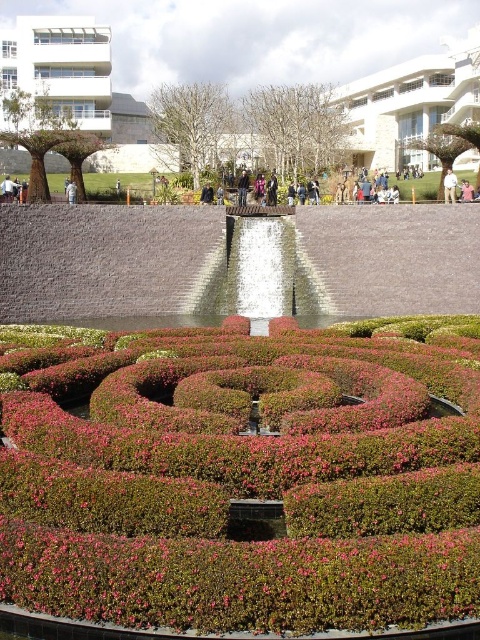
Question: Based on their relative distances, which object is farther from the light brown leather jacket at center?

Choices:
 (A) green leafy hedge at center
 (B) light brown wooden statue at center
 (C) light brown wooden bench at center
 (D) light brown leather jacket at lower left

Answer: (A)

Question: Is dark blue jeans at center above light brown wooden bench at center?

Choices:
 (A) no
 (B) yes

Answer: (B)

Question: Is light beige pants at center positioned behind light brown leather jacket at lower left?

Choices:
 (A) no
 (B) yes

Answer: (A)

Question: Among these points, which one is nearest to the camera?

Choices:
 (A) (462, 189)
 (B) (69, 192)
 (C) (452, 184)
 (D) (16, 189)

Answer: (B)

Question: Is green leafy hedge at center to the right of light beige pants at center from the viewer's perspective?

Choices:
 (A) yes
 (B) no

Answer: (B)

Question: Which point is closer to the camera?

Choices:
 (A) light brown wooden statue at center
 (B) dark blue jeans at center

Answer: (A)